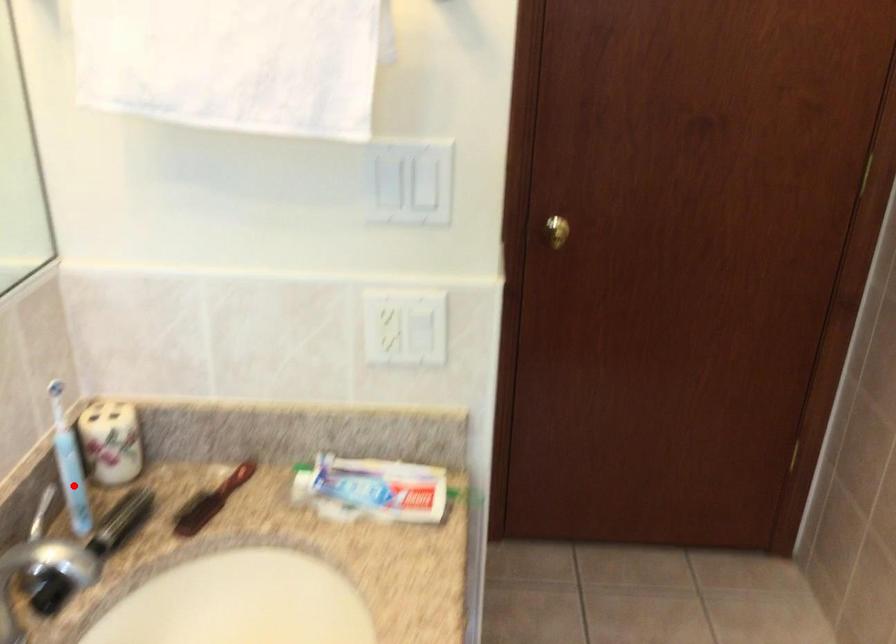
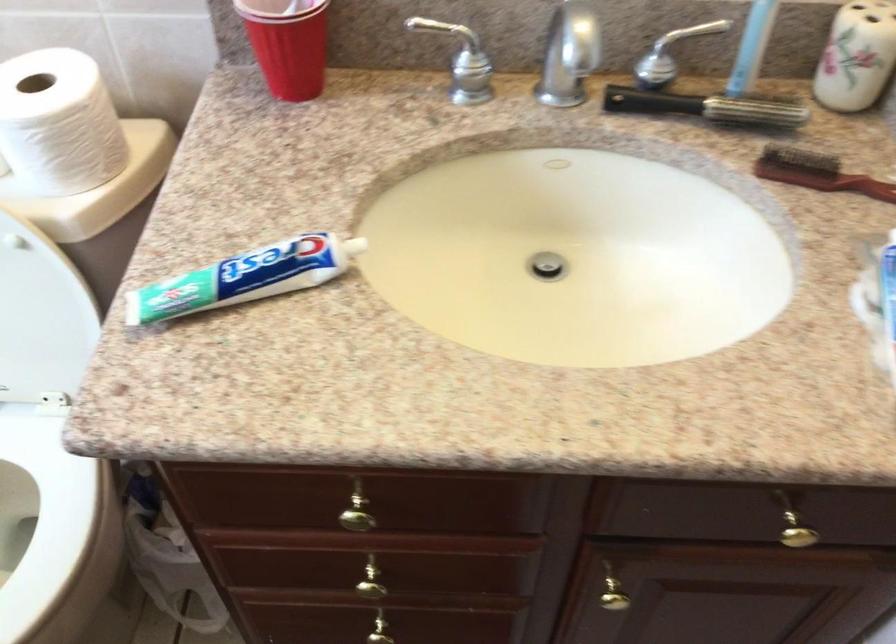
Question: I am providing you with two images of the same scene from different viewpoints. Image1 has a red point marked. In image2, the corresponding 3D location appears at what relative position? Reply with the corresponding letter.

Choices:
 (A) Closer
 (B) Farther

Answer: (A)